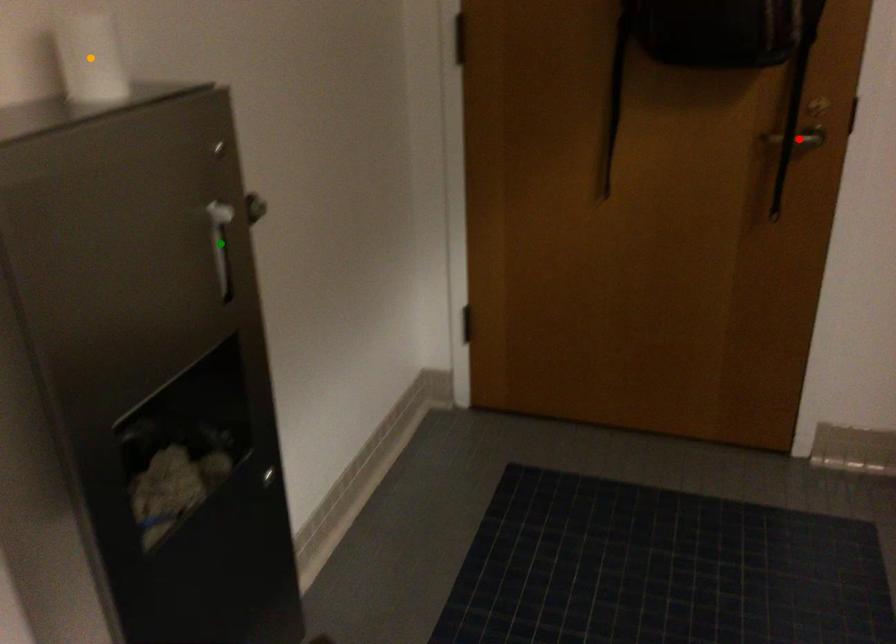
Order these from farthest to nearest:
red point | orange point | green point

1. red point
2. green point
3. orange point